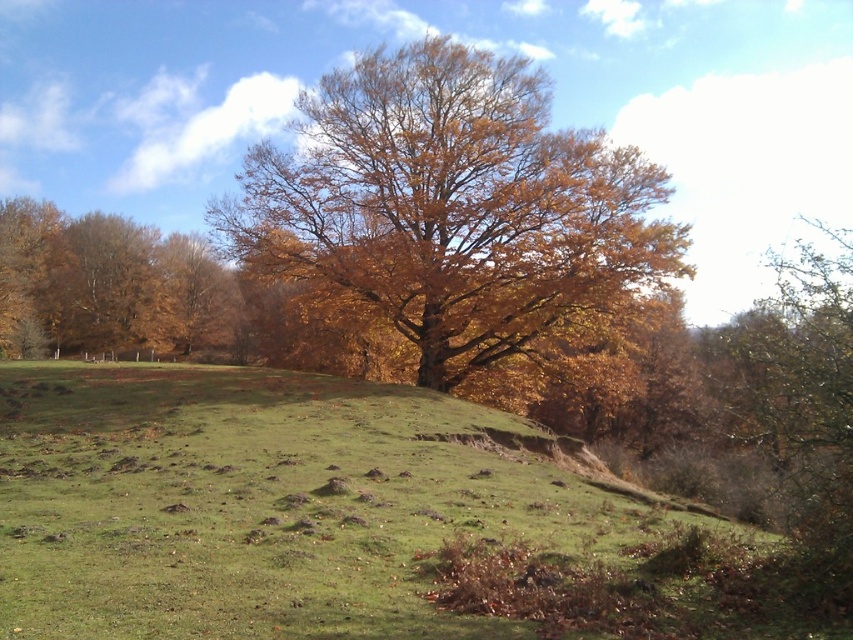
Question: Where is golden-brown wood at center located in relation to brown leafy tree at left in the image?

Choices:
 (A) below
 (B) above

Answer: (B)

Question: Can you confirm if green grass at center is positioned below brown leafy tree at left?

Choices:
 (A) no
 (B) yes

Answer: (B)

Question: Estimate the real-world distances between objects in this image. Which object is farther from the green grass at center?

Choices:
 (A) brown leafy tree at left
 (B) golden-brown wood at center

Answer: (A)

Question: Which object appears farthest from the camera in this image?

Choices:
 (A) brown leafy tree at left
 (B) golden-brown wood at center

Answer: (A)

Question: Which point is farther from the camera taking this photo?

Choices:
 (A) (173, 285)
 (B) (144, 618)
 (C) (466, 204)

Answer: (A)

Question: Can you confirm if green grass at center is positioned below brown leafy tree at left?

Choices:
 (A) no
 (B) yes

Answer: (B)